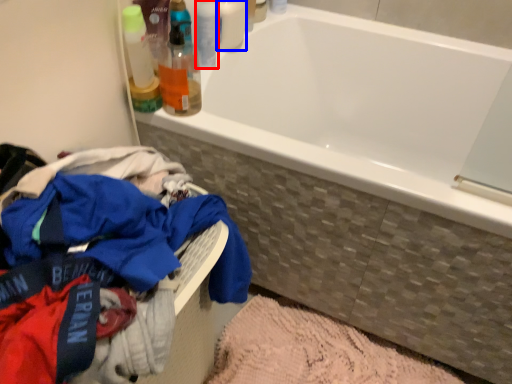
Question: Which object is closer to the camera taking this photo, toiletry (highlighted by a red box) or toiletry (highlighted by a blue box)?

Choices:
 (A) toiletry
 (B) toiletry

Answer: (B)